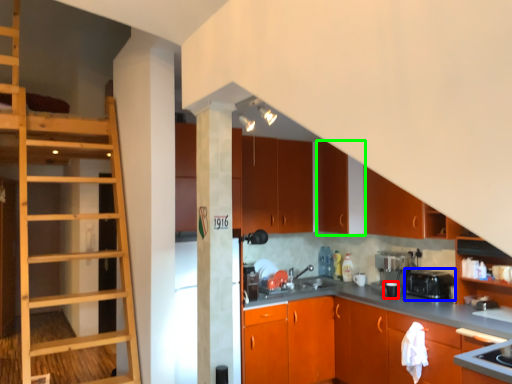
Question: Which object is the closest to the appliance (highlighted by a red box)? Choose among these: appliance (highlighted by a blue box) or cabinetry (highlighted by a green box).

Choices:
 (A) appliance
 (B) cabinetry

Answer: (A)